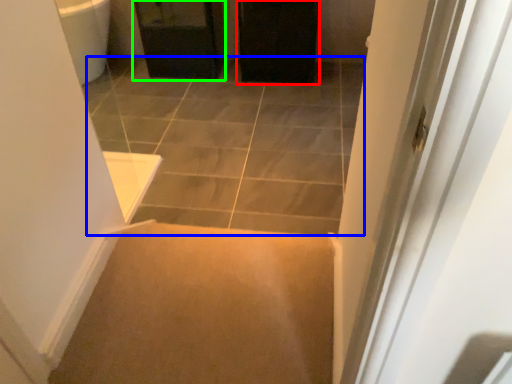
Question: Which is farther away from screen door (highlighted by a red box)? path (highlighted by a blue box) or cabinetry (highlighted by a green box)?

Choices:
 (A) path
 (B) cabinetry

Answer: (A)